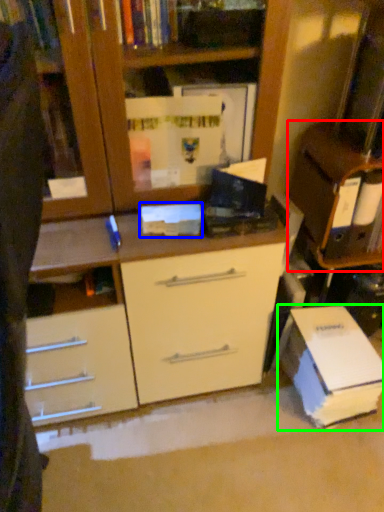
Question: Which object is the closest to the cabinetry (highlighted by a red box)? Choose among these: paperback book (highlighted by a blue box) or paperback book (highlighted by a green box).

Choices:
 (A) paperback book
 (B) paperback book

Answer: (B)